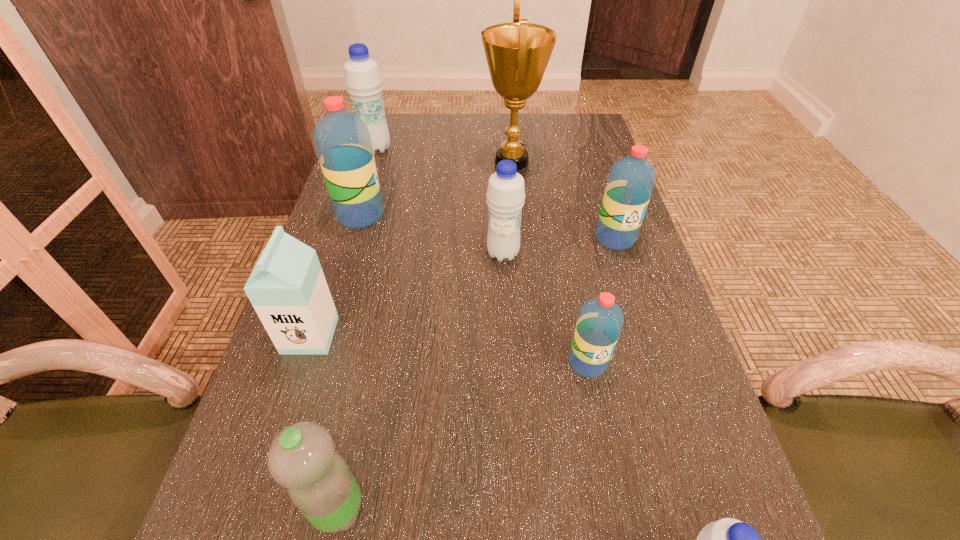
Find the location of a particular element. This screenshot has width=960, height=540. free space located 0.090m on the left of the green water bottle is located at coordinates (251, 509).

The width and height of the screenshot is (960, 540). I want to click on vacant space located 0.140m on the right of the milk carton, so click(405, 335).

You are a GUI agent. You are given a task and a screenshot of the screen. Output one action in this format:
    pyautogui.click(x=<x>, y=<y>)
    Task: Click on the vacant region located on the front label of the nearest red water bottle
    Image resolution: width=960 pixels, height=540 pixels.
    Given the screenshot: What is the action you would take?
    pyautogui.click(x=607, y=458)

Locate an element on the screen. This screenshot has width=960, height=540. award that is at the far edge is located at coordinates (517, 53).

I want to click on water bottle located in the far edge section of the desktop, so click(363, 80).

The width and height of the screenshot is (960, 540). Find the location of `milk carton that is at the left edge`. milk carton that is at the left edge is located at coordinates (287, 288).

Locate an element on the screen. This screenshot has width=960, height=540. object at the far left corner is located at coordinates (363, 80).

The width and height of the screenshot is (960, 540). I want to click on vacant region at the far edge of the desktop, so click(481, 142).

This screenshot has height=540, width=960. In order to click on free space at the left edge in this screenshot , I will do `click(402, 180)`.

The image size is (960, 540). What are the coordinates of `vacant space at the right edge of the desktop` in the screenshot? It's located at (714, 431).